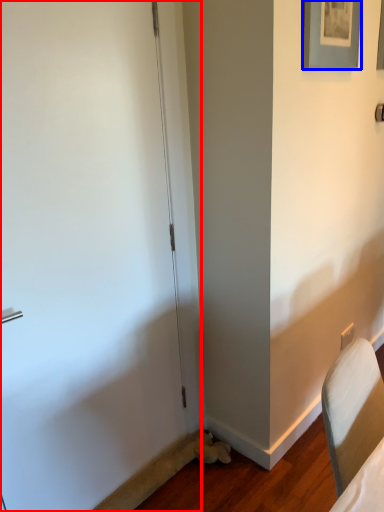
Question: Which object appears farthest to the camera in this image, door (highlighted by a red box) or picture frame (highlighted by a blue box)?

Choices:
 (A) door
 (B) picture frame

Answer: (B)